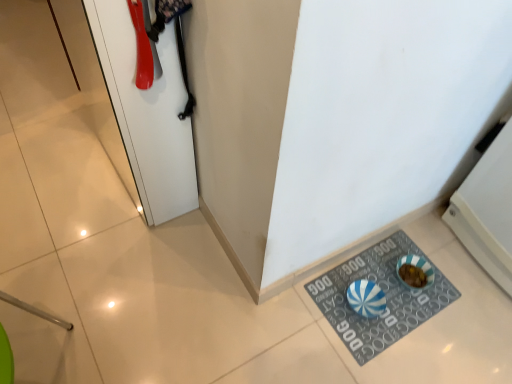
You are a GUI agent. You are given a task and a screenshot of the screen. Output one action in this format:
    pyautogui.click(x=<x>, y=<y>)
    Task: Click on the vacant area that is in front of white glossy door at upper left
    This screenshot has width=512, height=384.
    Given the screenshot: What is the action you would take?
    pyautogui.click(x=112, y=255)